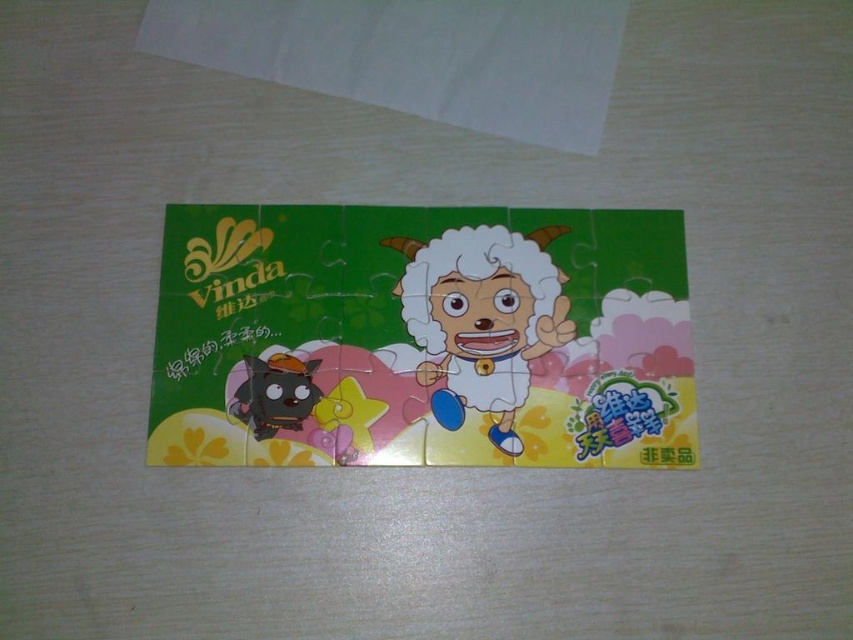
Question: In this image, where is white plush toy at center located relative to shiny black plush toy at bottom left?

Choices:
 (A) right
 (B) left

Answer: (A)

Question: Is white plush toy at center positioned at the back of shiny black plush toy at bottom left?

Choices:
 (A) no
 (B) yes

Answer: (A)

Question: Which point appears farthest from the camera in this image?

Choices:
 (A) (263, 401)
 (B) (450, 362)

Answer: (B)

Question: Does white plush toy at center come behind shiny black plush toy at bottom left?

Choices:
 (A) no
 (B) yes

Answer: (A)

Question: Which point appears farthest from the camera in this image?

Choices:
 (A) (480, 332)
 (B) (302, 380)

Answer: (A)